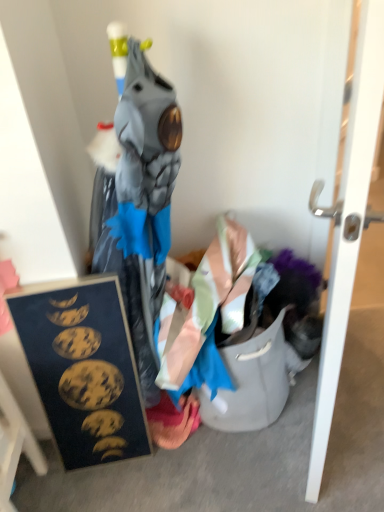
Identify the location of free space underneath wooden frame at lower left (from a real-world perspective). Image resolution: width=384 pixels, height=512 pixels. (23, 493).